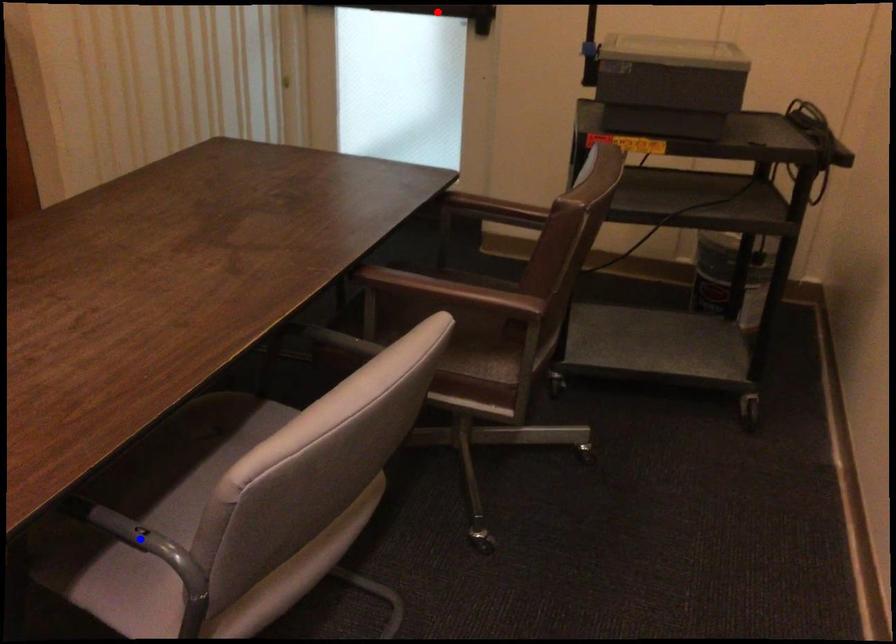
Question: Which of the two points in the image is closer to the camera?

Choices:
 (A) Blue point is closer.
 (B) Red point is closer.

Answer: (A)